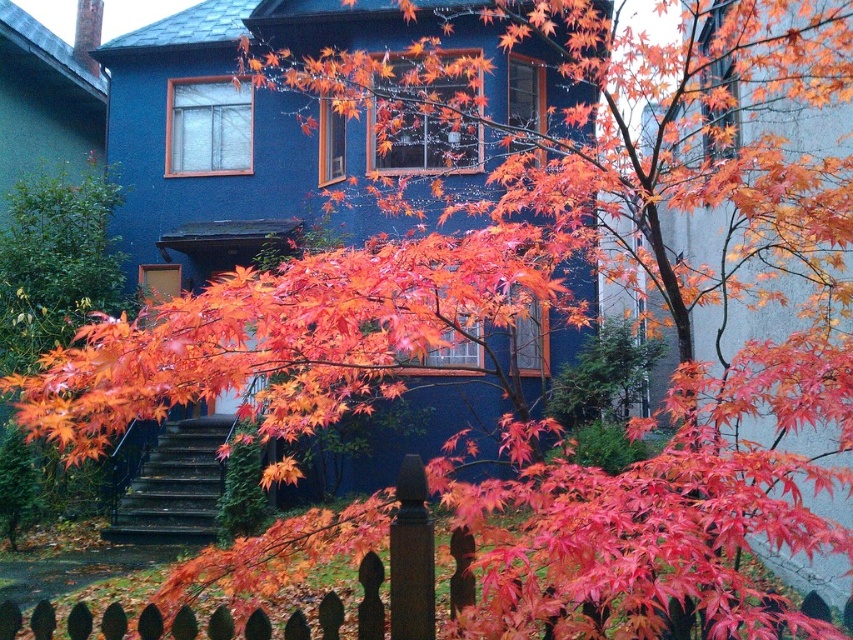
Is vivid orange maple leaf at center shorter than wooden picket fence at lower center?

No.

Is vivid orange maple leaf at center thinner than wooden picket fence at lower center?

No.

What do you see at coordinates (292, 336) in the screenshot? I see `vivid orange maple leaf at center` at bounding box center [292, 336].

The width and height of the screenshot is (853, 640). I want to click on vivid orange maple leaf at center, so click(292, 336).